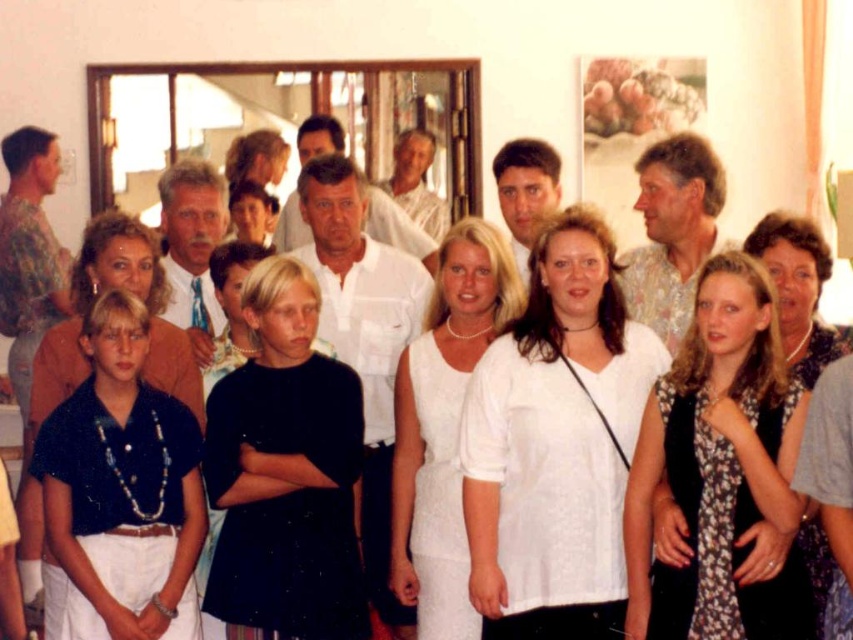
Consider the image. You are standing in the room and want to hand a gift to the person wearing the white lace blouse at center. Based on their position in the room, can you estimate whether they are closer to the window or the opposite wall?

The white lace blouse at center is located at point (555,444), which places them closer to the window in the background than the opposite wall. Therefore, the person is nearer to the window.

You are organizing a clothing display and need to place the white lace blouse at center and the black matte dress at center on a rack. If the rack has limited space, which item should you prioritize placing first to ensure both fit?

The white lace blouse at center is larger than the black matte dress at center, so you should prioritize placing the white lace blouse at center first to accommodate its size, then fit the smaller black matte dress at center next.